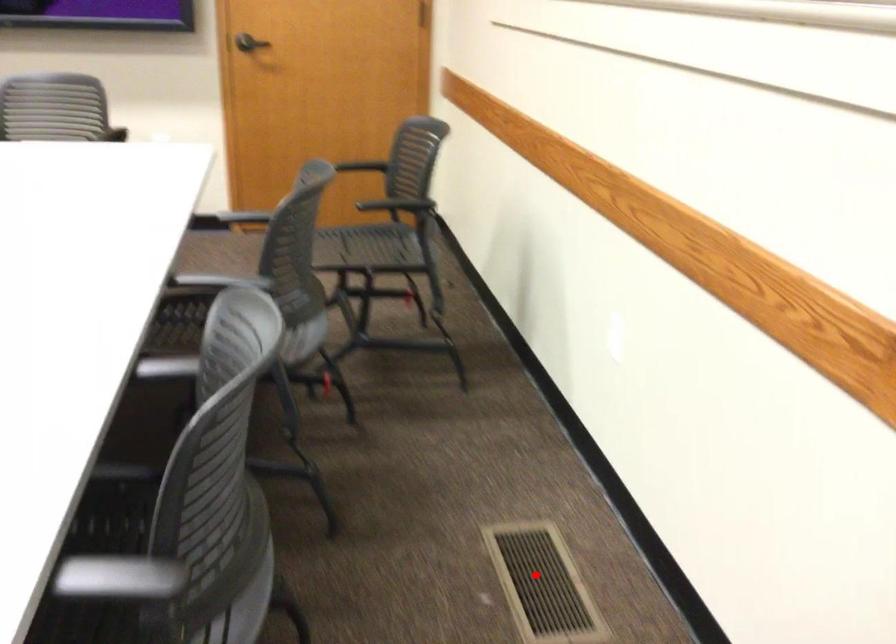
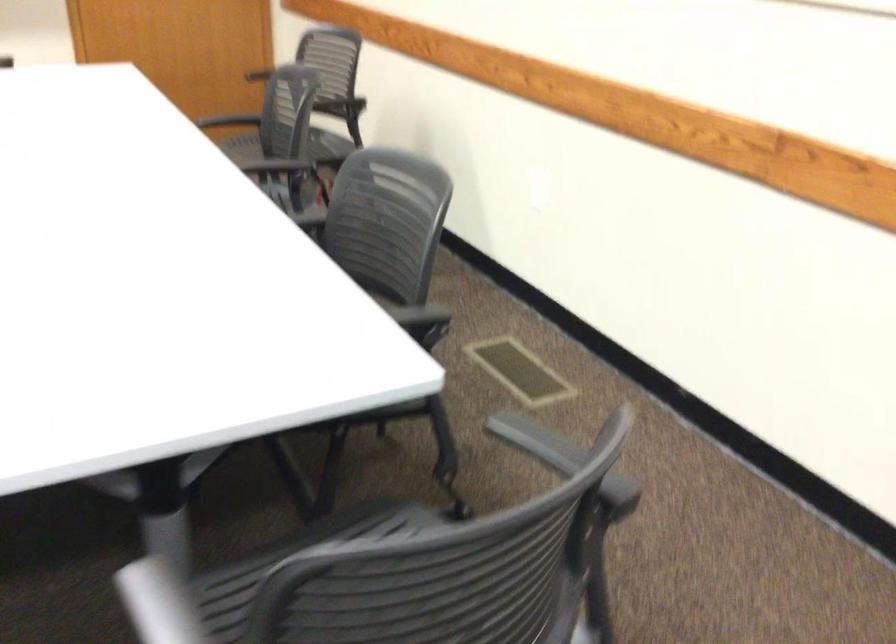
In the second image, find the point that corresponds to the highlighted location in the first image.

(520, 370)